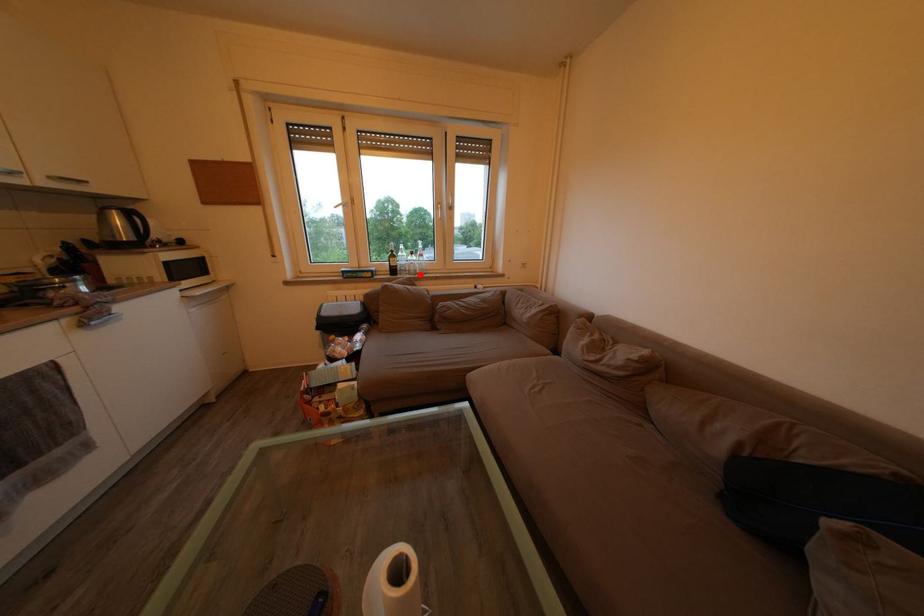
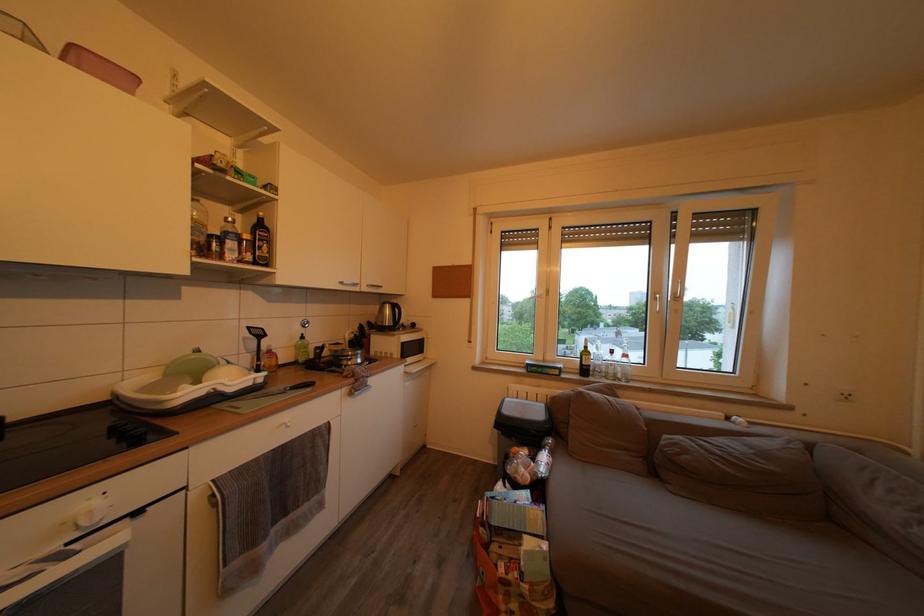
Where in the second image is the point corresponding to the highlighted location from the first image?

(618, 378)